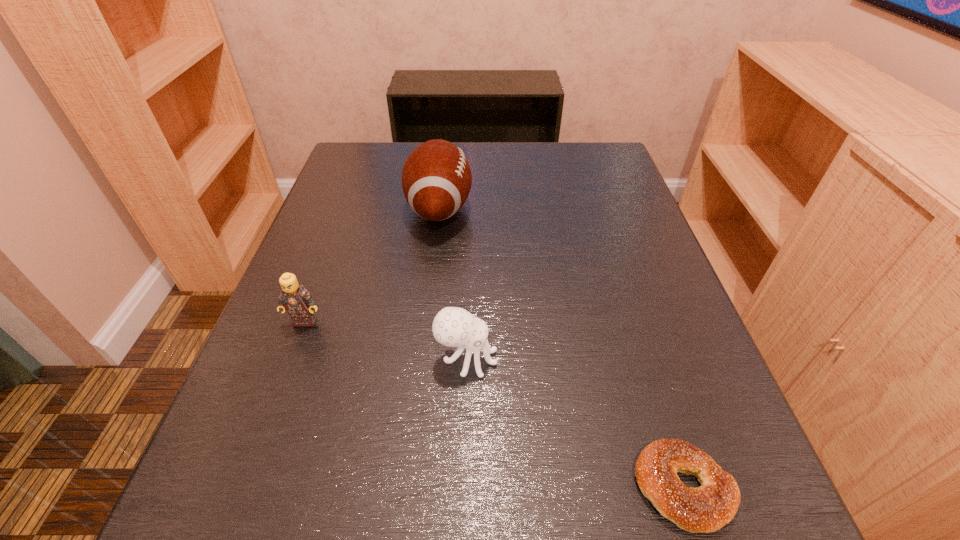
The height and width of the screenshot is (540, 960). Identify the location of free space at the near left corner. (290, 491).

This screenshot has height=540, width=960. I want to click on blank space at the far right corner, so click(x=587, y=165).

What are the coordinates of `free space between the tallest object and the Lego` in the screenshot? It's located at (372, 265).

You are a GUI agent. You are given a task and a screenshot of the screen. Output one action in this format:
    pyautogui.click(x=<x>, y=<y>)
    Task: Click on the unoccupied position between the tallest object and the octopus
    Image resolution: width=960 pixels, height=540 pixels.
    Given the screenshot: What is the action you would take?
    pyautogui.click(x=453, y=284)

Where is `free spot between the shortest object and the octopus`? The image size is (960, 540). free spot between the shortest object and the octopus is located at coordinates (575, 423).

You are a GUI agent. You are given a task and a screenshot of the screen. Output one action in this format:
    pyautogui.click(x=<x>, y=<y>)
    Task: Click on the free space between the tallest object and the third farthest object
    The image size is (960, 540).
    Given the screenshot: What is the action you would take?
    pyautogui.click(x=453, y=284)

Locate an element on the screen. Image resolution: width=960 pixels, height=540 pixels. vacant space that is in between the third farthest object and the nearest object is located at coordinates (575, 423).

The width and height of the screenshot is (960, 540). What are the coordinates of `vacant point located between the second nearest object and the farthest object` in the screenshot? It's located at (453, 284).

The height and width of the screenshot is (540, 960). I want to click on vacant region between the bagel and the tallest object, so click(x=562, y=347).

Find the location of `free space between the third nearest object and the third farthest object`. free space between the third nearest object and the third farthest object is located at coordinates (385, 340).